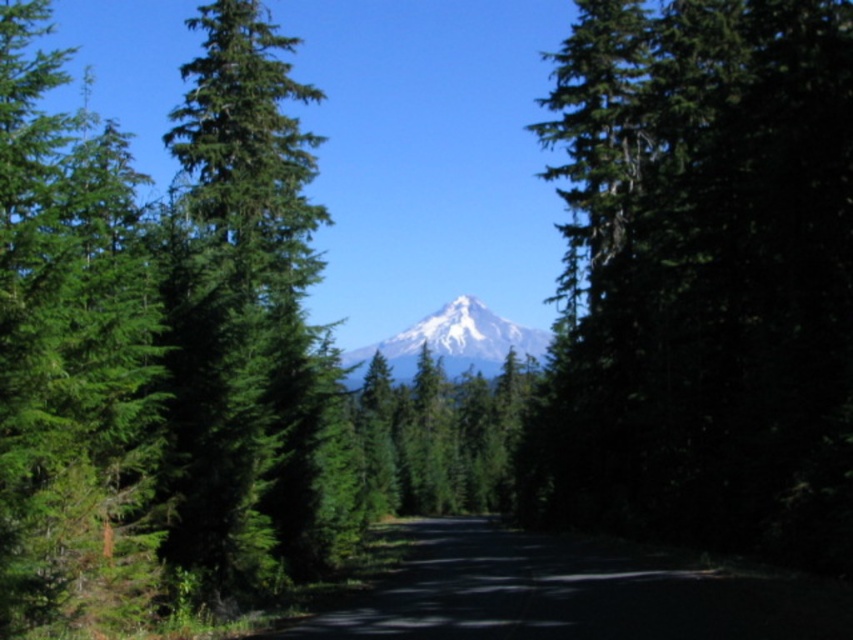
Can you confirm if green matte tree at right is smaller than white snow-covered mountain at center?

Correct, green matte tree at right occupies less space than white snow-covered mountain at center.

The width and height of the screenshot is (853, 640). What do you see at coordinates (703, 280) in the screenshot?
I see `green matte tree at right` at bounding box center [703, 280].

Locate an element on the screen. Image resolution: width=853 pixels, height=640 pixels. green matte tree at right is located at coordinates (703, 280).

Which of these two, green matte tree at right or green needle-like tree at left, stands shorter?

green matte tree at right

Is the position of green matte tree at right more distant than that of green needle-like tree at left?

Yes.

Is point (699, 262) positioned after point (167, 275)?

Yes, it is behind point (167, 275).

Where is `green matte tree at right`? The height and width of the screenshot is (640, 853). green matte tree at right is located at coordinates [703, 280].

Is green needle-like tree at left taller than white snow-covered mountain at center?

Correct, green needle-like tree at left is much taller as white snow-covered mountain at center.

Is green needle-like tree at left further to camera compared to white snow-covered mountain at center?

No, it is in front of white snow-covered mountain at center.

This screenshot has height=640, width=853. I want to click on green needle-like tree at left, so click(x=244, y=314).

Find the location of a particular element. green needle-like tree at left is located at coordinates (244, 314).